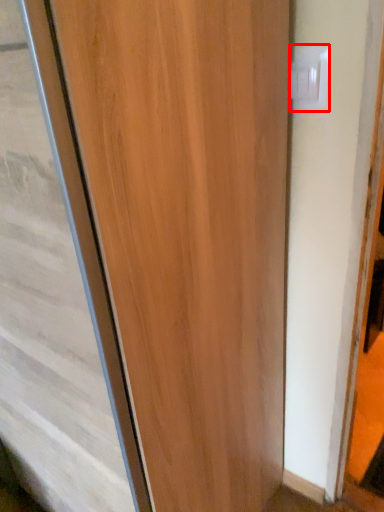
Question: From the image's perspective, considering the relative positions of electric outlet (annotated by the red box) and door in the image provided, where is electric outlet (annotated by the red box) located with respect to the staircase?

Choices:
 (A) above
 (B) below

Answer: (A)